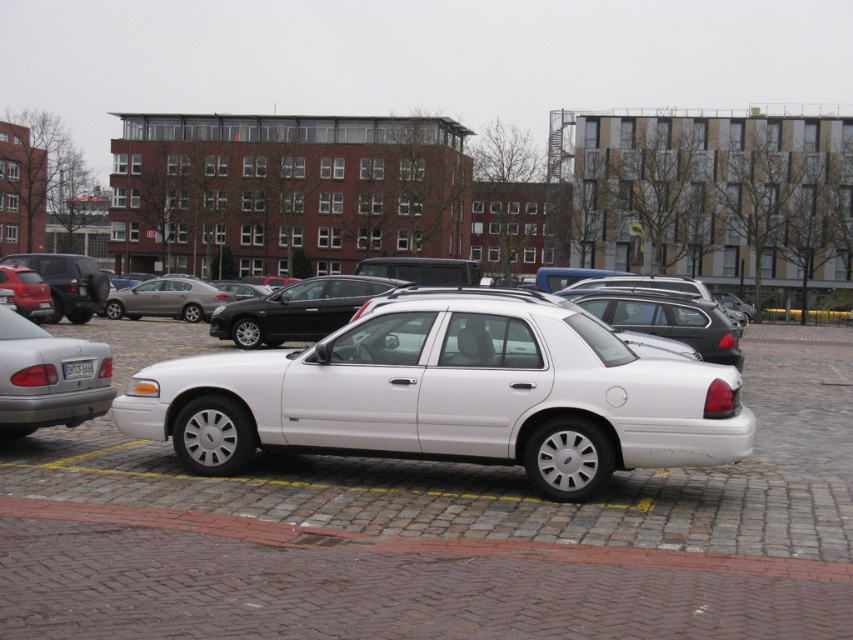
Question: Can you confirm if white glossy car at center is bigger than white glossy sedan at center?

Choices:
 (A) yes
 (B) no

Answer: (A)

Question: Based on their relative distances, which object is nearer to the white plastic license plate at center?

Choices:
 (A) satin black sedan at center
 (B) white glossy sedan at center
 (C) white glossy car at center

Answer: (B)

Question: Is white glossy car at center further to the viewer compared to silver metallic sedan at left?

Choices:
 (A) yes
 (B) no

Answer: (B)

Question: Can you confirm if white glossy sedan at center is thinner than silver metallic sedan at left?

Choices:
 (A) yes
 (B) no

Answer: (B)

Question: Estimate the real-world distances between objects in this image. Which object is closer to the silver metallic sedan at left?

Choices:
 (A) white plastic license plate at center
 (B) white glossy sedan at center
 (C) satin black sedan at center

Answer: (A)

Question: Which object is farther from the camera taking this photo?

Choices:
 (A) satin black sedan at center
 (B) white glossy car at center
 (C) white glossy sedan at center

Answer: (A)